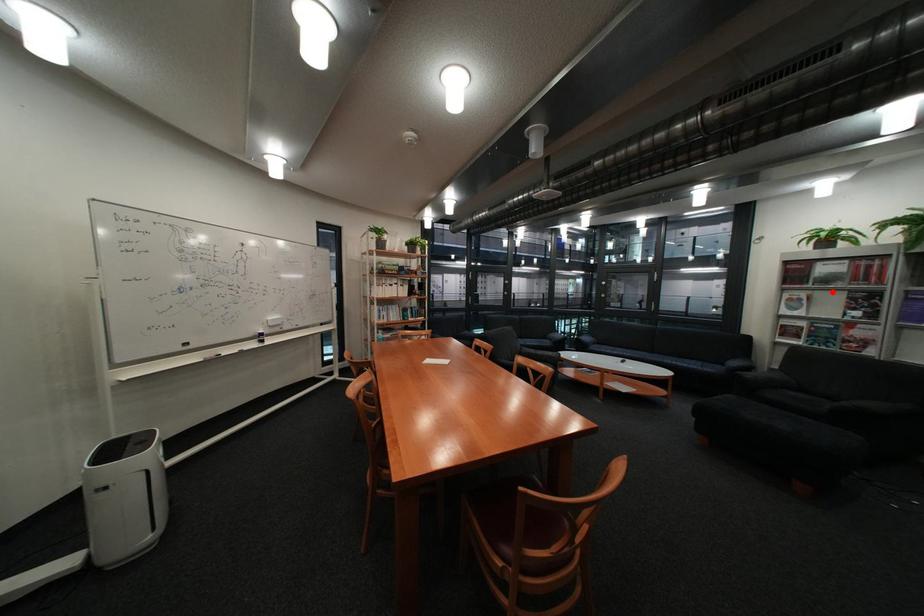
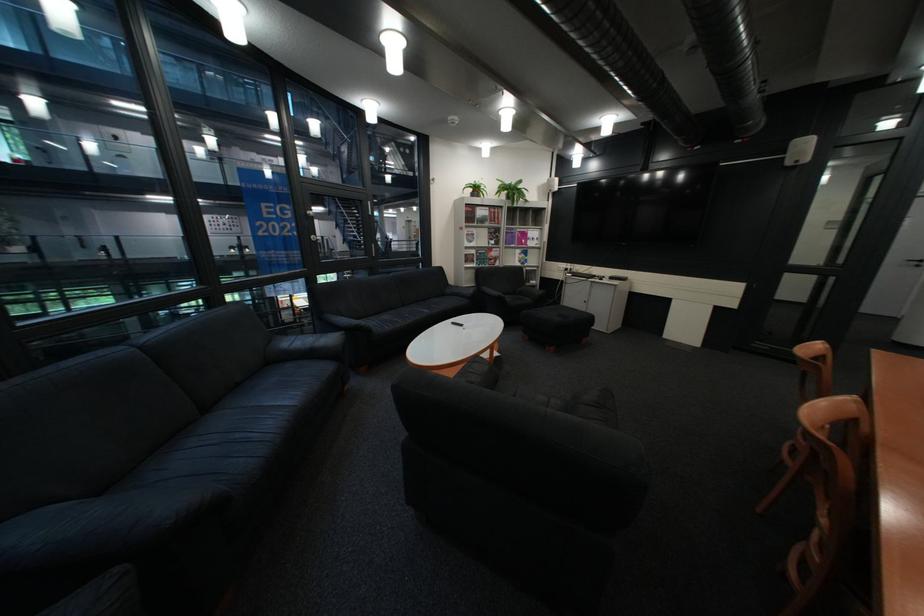
Question: I am providing you with two images of the same scene from different viewpoints. Image1 has a red point marked. In image2, the corresponding 3D location appears at what relative position? Reply with the corresponding letter.

Choices:
 (A) Closer
 (B) Farther

Answer: (A)